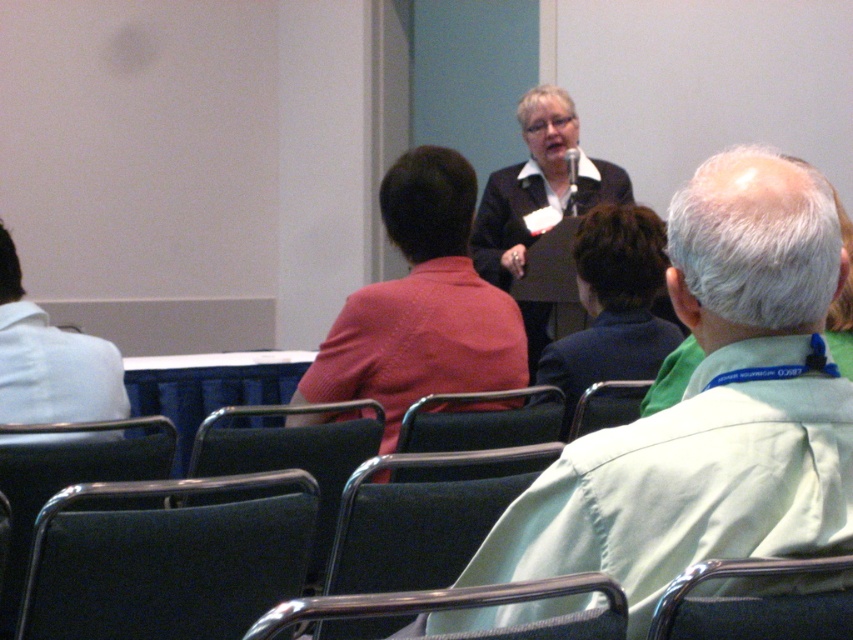
You are sitting in the front row of the conference room and notice a point marked at coordinates [50,360]. Based on the scene description, what object is located at that point?

The point at coordinates [50,360] indicates the white fabric shirt at left.

You are sitting in the front row of the conference room and want to take a photo of both the speaker and the attendee in the back row. The speaker is at point (49, 337) and the attendee is at point (646, 384). Will both points be in focus if you focus on the speaker?

Yes, because point (49, 337) is closer to the camera than point (646, 384). When focusing on the speaker at point (49, 337), the attendee at point (646, 384) will be further away but still within the depth of field, so both will be in focus.